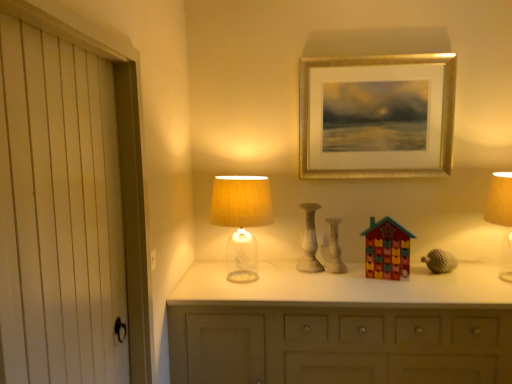
Question: In the image, is translucent glass lampshade at center, which is the 1th table lamp in left-to-right order, on the left side or the right side of matte gray acorn at right?

Choices:
 (A) left
 (B) right

Answer: (A)

Question: From the image's perspective, relative to matte gray acorn at right, is translucent glass lampshade at center, which is the 1th table lamp in left-to-right order, above or below?

Choices:
 (A) below
 (B) above

Answer: (B)

Question: Which object is positioned closest to the translucent glass lampshade at center, which is counted as the second table lamp, starting from the right?

Choices:
 (A) matte ceramic house at center, the 2th toy when ordered from front to back
 (B) gold metallic picture frame at upper center
 (C) multicolored plastic advent calendar at center, positioned as the 2th toy in left-to-right order
 (D) white wood door at left
 (E) white marble candle holder at center

Answer: (E)

Question: Considering the real-world distances, which object is farthest from the matte gray acorn at right?

Choices:
 (A) white wood door at left
 (B) white marble candle holder at center
 (C) matte yellow fabric lampshade at right, the second table lamp positioned from the left
 (D) matte ceramic house at center, marked as the 1th toy in a back-to-front arrangement
 (E) gold metallic picture frame at upper center

Answer: (A)